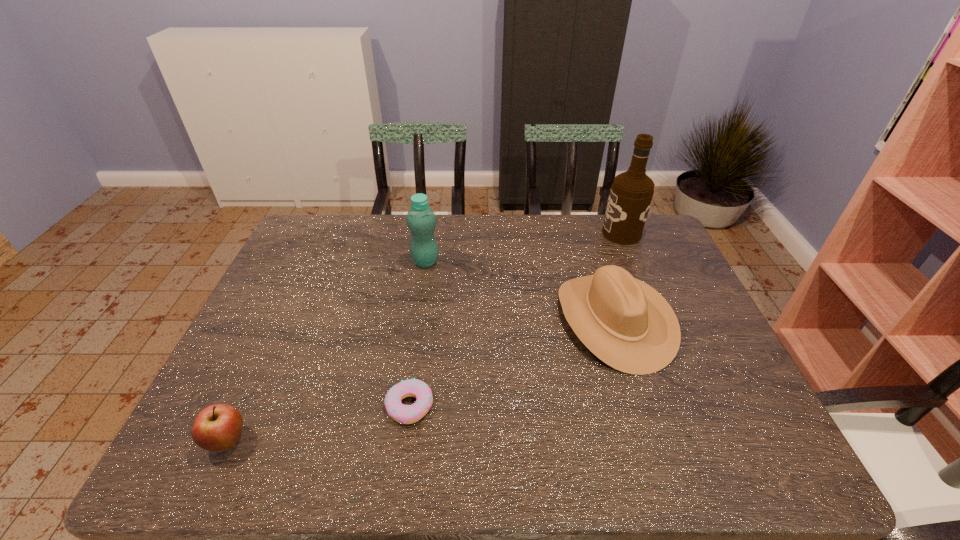
Where is `the farthest object`? The image size is (960, 540). the farthest object is located at coordinates (631, 193).

The image size is (960, 540). Identify the location of alcohol. (631, 193).

Locate an element on the screen. This screenshot has width=960, height=540. the second farthest object is located at coordinates (421, 220).

The height and width of the screenshot is (540, 960). What are the coordinates of `water bottle` in the screenshot? It's located at (421, 220).

Where is `the third tallest object`? This screenshot has height=540, width=960. the third tallest object is located at coordinates (626, 323).

Find the location of a particular element. The height and width of the screenshot is (540, 960). the third farthest object is located at coordinates tap(626, 323).

I want to click on the leftmost object, so click(218, 427).

At what (x,y) coordinates should I click in order to perform the action: click on the fourth tallest object. Please return your answer as a coordinate pair (x, y). The width and height of the screenshot is (960, 540). Looking at the image, I should click on (218, 427).

At what (x,y) coordinates should I click in order to perform the action: click on the shortest object. Please return your answer as a coordinate pair (x, y). Looking at the image, I should click on (405, 414).

The image size is (960, 540). I want to click on vacant area situated on the label of the tallest object, so [494, 233].